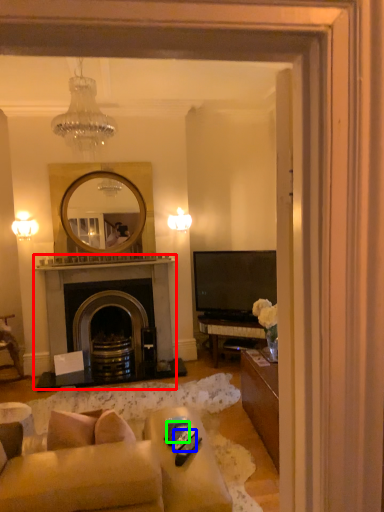
Question: Which object is positioned closest to fireplace (highlighted by a red box)? Select from remote control (highlighted by a blue box) and remote control (highlighted by a green box).

Choices:
 (A) remote control
 (B) remote control

Answer: (B)